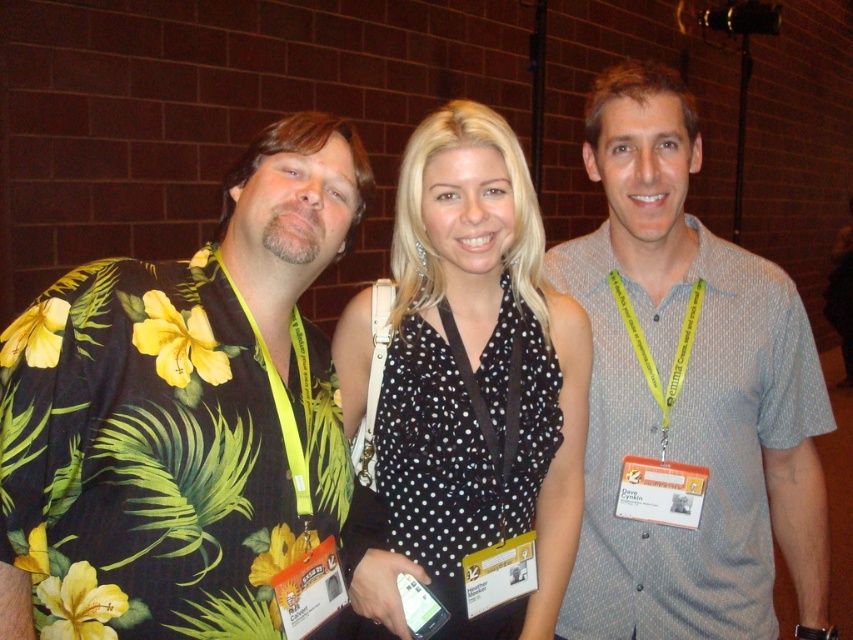
You are a photographer trying to capture a group photo of the three people. The camera you are using has a focus range of 30 inches. Can you focus on both the floral print shirt at left and the gray dotted shirt at center without adjusting your position?

The floral print shirt at left is 29.85 inches away from the gray dotted shirt at center, so yes, the camera can focus on both the floral print shirt at left and the gray dotted shirt at center since the distance between them is within the focus range of 30 inches.

You are trying to take a photo of the three people in the image. You want to ensure that both the point at (625, 582) and the point at (584, 426) are visible in the frame. Based on their positions, which point is further away from the camera?

Point at (625, 582) is behind point at (584, 426), so it is further away from the camera.

You are a photographer standing 2 meters away from the camera. You want to take a photo of the gray dotted shirt at center. Can you reach it with your hand to adjust it before taking the shot?

The gray dotted shirt at center is 1.67 meters away from the camera. Since you are standing 2 meters away from the camera, you are 3.67 meters away from the gray dotted shirt at center. Therefore, you cannot reach it with your hand to adjust it before taking the shot.